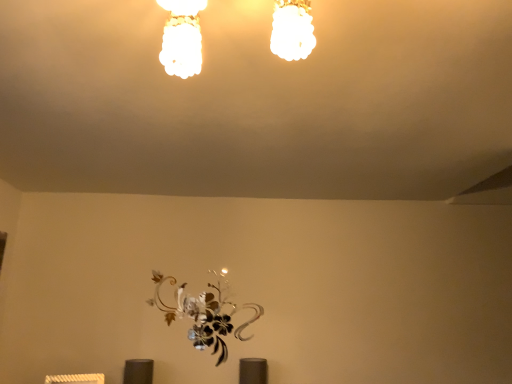
Question: Is matte glass chandelier at upper center outside of metallic silver flower at center?

Choices:
 (A) yes
 (B) no

Answer: (A)

Question: Is matte glass chandelier at upper center facing towards metallic silver flower at center?

Choices:
 (A) no
 (B) yes

Answer: (A)

Question: Is metallic silver flower at center located within matte glass chandelier at upper center?

Choices:
 (A) no
 (B) yes

Answer: (A)

Question: Are matte glass chandelier at upper center and metallic silver flower at center far apart?

Choices:
 (A) no
 (B) yes

Answer: (B)

Question: From the image's perspective, is matte glass chandelier at upper center on top of metallic silver flower at center?

Choices:
 (A) no
 (B) yes

Answer: (B)

Question: Does matte glass chandelier at upper center have a larger size compared to metallic silver flower at center?

Choices:
 (A) yes
 (B) no

Answer: (A)

Question: Is metallic silver flower at center shorter than matte glass chandelier at upper center?

Choices:
 (A) yes
 (B) no

Answer: (B)

Question: Is metallic silver flower at center smaller than matte glass chandelier at upper center?

Choices:
 (A) yes
 (B) no

Answer: (A)

Question: Does metallic silver flower at center have a larger size compared to matte glass chandelier at upper center?

Choices:
 (A) no
 (B) yes

Answer: (A)

Question: Is metallic silver flower at center surrounding matte glass chandelier at upper center?

Choices:
 (A) no
 (B) yes

Answer: (A)

Question: Considering the relative sizes of metallic silver flower at center and matte glass chandelier at upper center in the image provided, is metallic silver flower at center wider than matte glass chandelier at upper center?

Choices:
 (A) no
 (B) yes

Answer: (A)

Question: Is metallic silver flower at center turned away from matte glass chandelier at upper center?

Choices:
 (A) yes
 (B) no

Answer: (B)

Question: Considering the positions of matte glass chandelier at upper center and metallic silver flower at center in the image, is matte glass chandelier at upper center wider or thinner than metallic silver flower at center?

Choices:
 (A) wide
 (B) thin

Answer: (A)